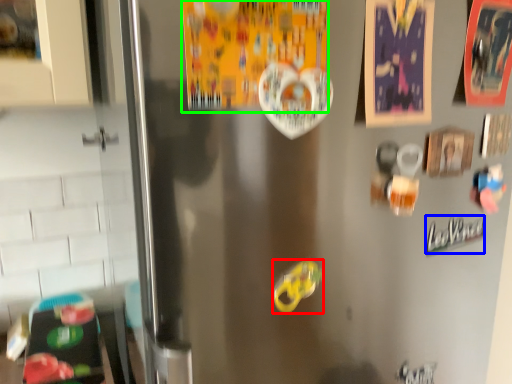
Question: Which object is the closest to the food (highlighted by a red box)? Choose among these: writing (highlighted by a blue box) or postcard (highlighted by a green box).

Choices:
 (A) writing
 (B) postcard

Answer: (B)